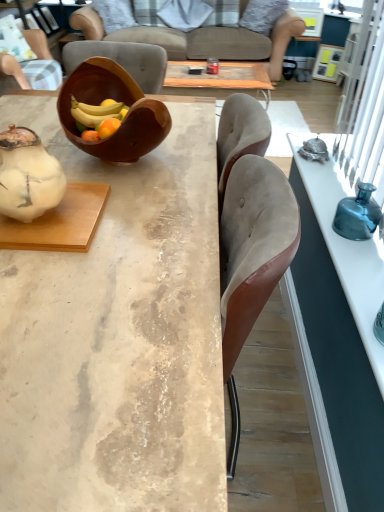
In order to click on vacant area on top of teal glass vase at right, acting as the 1th desk starting from the right (from a real-world perspective) in this screenshot , I will do `click(348, 228)`.